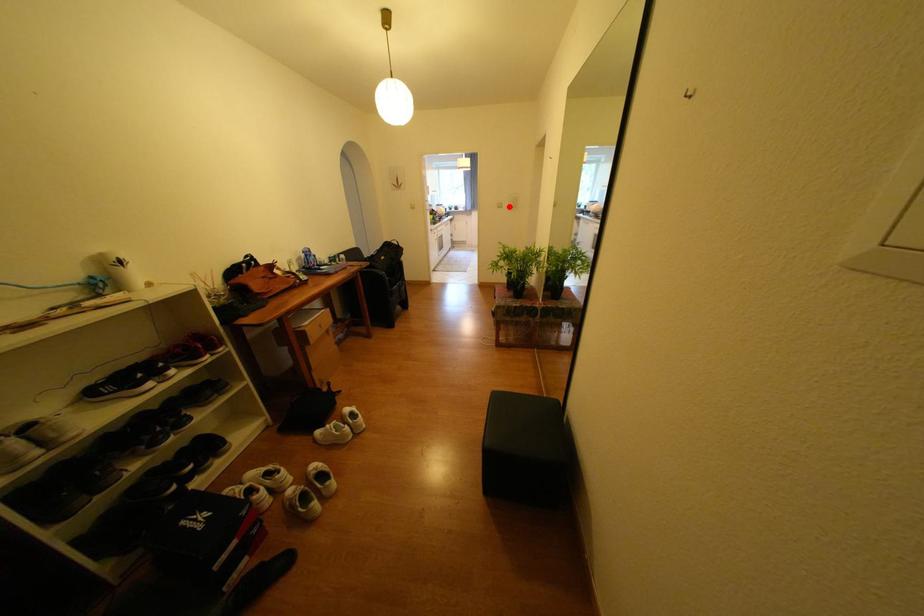
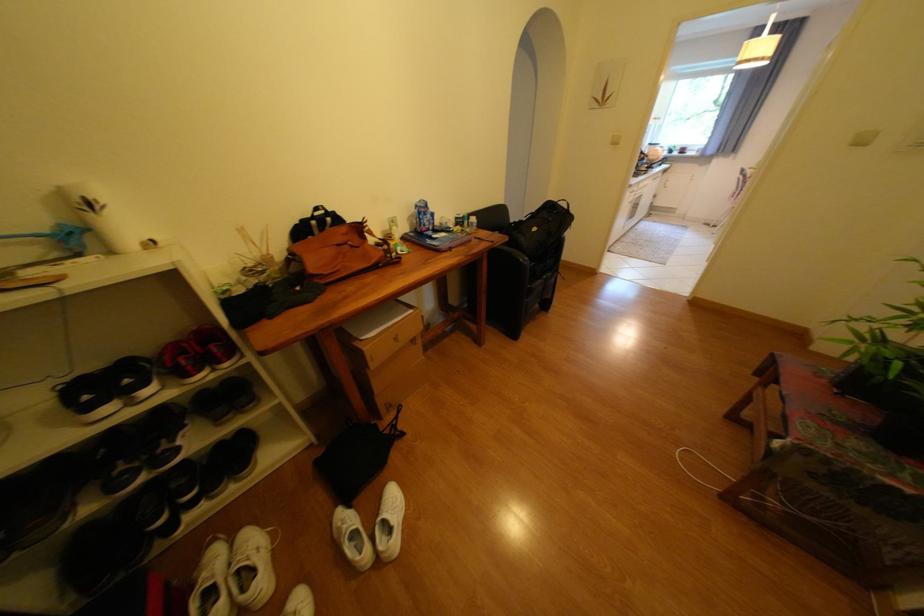
Question: I am providing you with two images of the same scene from different viewpoints. In image1, a red point is highlighted. Considering the same 3D point in image2, which of the following is correct?

Choices:
 (A) It is closer
 (B) It is farther

Answer: (B)